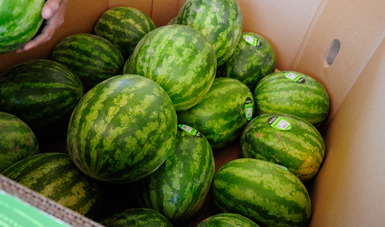
This screenshot has height=227, width=385. In order to click on box in this screenshot , I will do `click(360, 162)`, `click(350, 27)`, `click(271, 13)`, `click(83, 7)`.